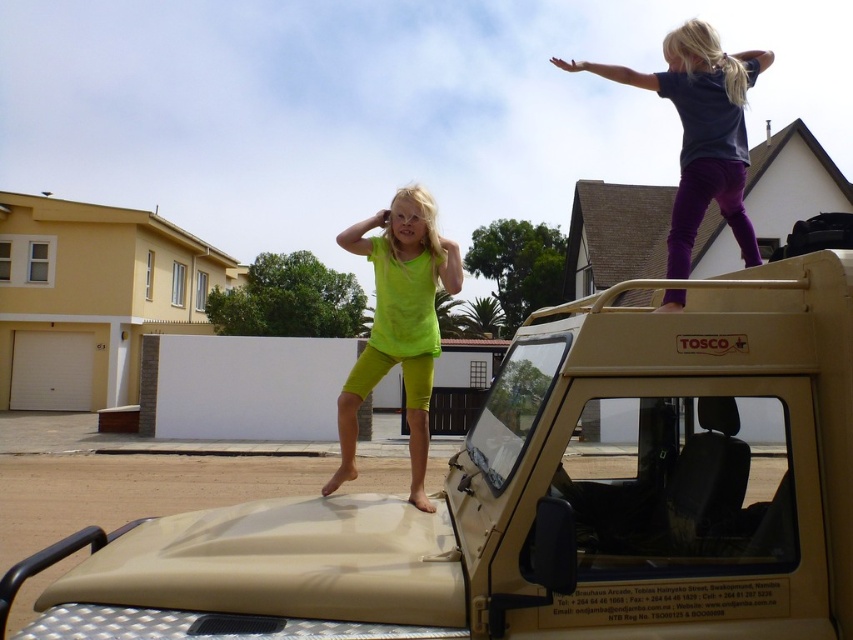
Who is shorter, neon green fabric at center or dark blue fabric at upper right?

With less height is neon green fabric at center.

Does neon green fabric at center have a greater height compared to dark blue fabric at upper right?

Incorrect, neon green fabric at center's height is not larger of dark blue fabric at upper right's.

Which is behind, point (425, 442) or point (762, 68)?

The point (762, 68) is behind.

At what (x,y) coordinates should I click in order to perform the action: click on neon green fabric at center. Please return your answer as a coordinate pair (x, y). This screenshot has width=853, height=640. Looking at the image, I should click on (398, 323).

Who is higher up, tan matte vehicle at center or neon green fabric at center?

tan matte vehicle at center is above.

Is point (805, 609) behind point (425, 196)?

No, it is not.

Which is behind, point (647, 556) or point (337, 420)?

The point (337, 420) is behind.

Find the location of a particular element. tan matte vehicle at center is located at coordinates (547, 499).

Between tan matte vehicle at center and dark blue fabric at upper right, which one appears on the right side from the viewer's perspective?

From the viewer's perspective, dark blue fabric at upper right appears more on the right side.

Does point (196, 588) lie in front of point (717, 97)?

Yes, it is.

Where is `tan matte vehicle at center`? The image size is (853, 640). tan matte vehicle at center is located at coordinates (547, 499).